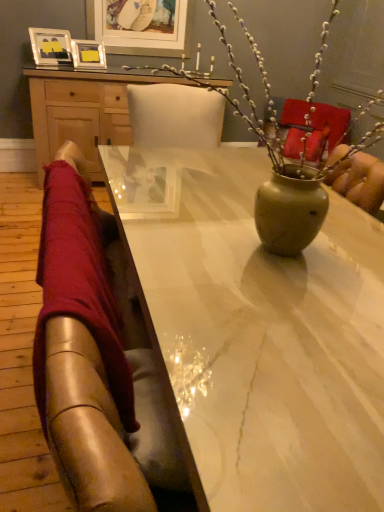
In order to face denim jeans at left, should I rotate leftwards or rightwards?

It's best to rotate left around 16.180 degrees.

Locate an element on the screen. This screenshot has height=512, width=384. wooden desk at upper center is located at coordinates (84, 111).

Measure the distance between point (91, 9) and camera.

Point (91, 9) and camera are 11.48 feet apart.

The width and height of the screenshot is (384, 512). I want to click on white marble table at center, so point(257,333).

Does matte silver picture frame at upper left, which is the first picture frame in left-to-right order, touch white marble table at center?

matte silver picture frame at upper left, which is the first picture frame in left-to-right order, and white marble table at center are not in contact.

Is matte silver picture frame at upper left, which is the first picture frame in left-to-right order, surrounding white marble table at center?

No.

Could you measure the distance between matte silver picture frame at upper left, which appears as the 3th picture frame when viewed from the right, and white marble table at center?

The distance of matte silver picture frame at upper left, which appears as the 3th picture frame when viewed from the right, from white marble table at center is 8.07 feet.

From a real-world perspective, is matte silver picture frame at upper left, which is the first picture frame in left-to-right order, located higher than white marble table at center?

Correct, in the physical world, matte silver picture frame at upper left, which is the first picture frame in left-to-right order, is higher than white marble table at center.

Is matte green vase at center turned away from matte silver picture frame at upper left, marked as the 2th picture frame in a left-to-right arrangement?

No, matte green vase at center is not facing the opposite direction of matte silver picture frame at upper left, marked as the 2th picture frame in a left-to-right arrangement.

Which object is further away from the camera taking this photo, matte green vase at center or matte silver picture frame at upper left, marked as the 2th picture frame in a left-to-right arrangement?

matte silver picture frame at upper left, marked as the 2th picture frame in a left-to-right arrangement, is behind.

Is matte green vase at center far away from matte silver picture frame at upper left, which appears as the second picture frame when viewed from the right?

Yes, matte green vase at center is far from matte silver picture frame at upper left, which appears as the second picture frame when viewed from the right.

Is matte green vase at center to the left of matte silver picture frame at upper left, marked as the 2th picture frame in a left-to-right arrangement, from the viewer's perspective?

In fact, matte green vase at center is to the right of matte silver picture frame at upper left, marked as the 2th picture frame in a left-to-right arrangement.

In the scene shown: Considering the positions of objects matte green vase at center and matte white picture frame at upper center, the 1th picture frame when ordered from right to left, in the image provided, who is more to the right, matte green vase at center or matte white picture frame at upper center, the 1th picture frame when ordered from right to left,?

Positioned to the right is matte green vase at center.

Can you confirm if matte green vase at center is bigger than matte white picture frame at upper center, marked as the 3th picture frame in a left-to-right arrangement?

Yes, matte green vase at center is bigger than matte white picture frame at upper center, marked as the 3th picture frame in a left-to-right arrangement.

Based on the photo, from the image's perspective, is matte green vase at center located beneath matte white picture frame at upper center, marked as the 3th picture frame in a left-to-right arrangement?

Correct, matte green vase at center appears lower than matte white picture frame at upper center, marked as the 3th picture frame in a left-to-right arrangement, in the image.

Is matte green vase at center shorter than matte white picture frame at upper center, marked as the 3th picture frame in a left-to-right arrangement?

No, matte green vase at center is not shorter than matte white picture frame at upper center, marked as the 3th picture frame in a left-to-right arrangement.

This screenshot has width=384, height=512. Find the location of `table to the right of matte white picture frame at upper center, marked as the 3th picture frame in a left-to-right arrangement`. table to the right of matte white picture frame at upper center, marked as the 3th picture frame in a left-to-right arrangement is located at coordinates (257, 333).

Could you tell me if matte white picture frame at upper center, the 1th picture frame when ordered from right to left, is facing white marble table at center?

Yes, matte white picture frame at upper center, the 1th picture frame when ordered from right to left, faces towards white marble table at center.

In the scene shown: From a real-world perspective, is matte white picture frame at upper center, the 1th picture frame when ordered from right to left, on top of white marble table at center?

Yes, from a real-world perspective, matte white picture frame at upper center, the 1th picture frame when ordered from right to left, is on top of white marble table at center.

Who is taller, matte silver picture frame at upper left, which appears as the second picture frame when viewed from the right, or white marble table at center?

Standing taller between the two is white marble table at center.

From the image's perspective, between matte silver picture frame at upper left, which appears as the second picture frame when viewed from the right, and white marble table at center, which one is located above?

matte silver picture frame at upper left, which appears as the second picture frame when viewed from the right, is shown above in the image.

Which is behind, matte silver picture frame at upper left, marked as the 2th picture frame in a left-to-right arrangement, or white marble table at center?

matte silver picture frame at upper left, marked as the 2th picture frame in a left-to-right arrangement, is further away from the camera.

Can we say matte silver picture frame at upper left, marked as the 2th picture frame in a left-to-right arrangement, lies outside white marble table at center?

Absolutely, matte silver picture frame at upper left, marked as the 2th picture frame in a left-to-right arrangement, is external to white marble table at center.

Based on the photo, does denim jeans at left have a greater width compared to wooden desk at upper center?

No, denim jeans at left is not wider than wooden desk at upper center.

From the image's perspective, would you say denim jeans at left is shown under wooden desk at upper center?

Correct, denim jeans at left appears lower than wooden desk at upper center in the image.

From a real-world perspective, is denim jeans at left positioned under wooden desk at upper center based on gravity?

Incorrect, from a real-world perspective, denim jeans at left is higher than wooden desk at upper center.

Which is more to the left, denim jeans at left or wooden desk at upper center?

wooden desk at upper center.

Can you confirm if matte silver picture frame at upper left, which is the first picture frame in left-to-right order, is positioned to the right of matte silver picture frame at upper left, marked as the 2th picture frame in a left-to-right arrangement?

Incorrect, matte silver picture frame at upper left, which is the first picture frame in left-to-right order, is not on the right side of matte silver picture frame at upper left, marked as the 2th picture frame in a left-to-right arrangement.

From a real-world perspective, who is located lower, matte silver picture frame at upper left, which is the first picture frame in left-to-right order, or matte silver picture frame at upper left, marked as the 2th picture frame in a left-to-right arrangement?

matte silver picture frame at upper left, marked as the 2th picture frame in a left-to-right arrangement, is physically lower.

In the scene shown: Which is in front, matte silver picture frame at upper left, which appears as the 3th picture frame when viewed from the right, or matte silver picture frame at upper left, which appears as the second picture frame when viewed from the right?

matte silver picture frame at upper left, which appears as the 3th picture frame when viewed from the right, is more forward.

You are a GUI agent. You are given a task and a screenshot of the screen. Output one action in this format:
    pyautogui.click(x=<x>, y=<y>)
    Task: Click on the table that is below the matte silver picture frame at upper left, which appears as the 3th picture frame when viewed from the right (from the image's perspective)
    The image size is (384, 512).
    Given the screenshot: What is the action you would take?
    pyautogui.click(x=257, y=333)

From a real-world perspective, count 2nd picture frames downward from the matte green vase at center and point to it. Please provide its 2D coordinates.

[(88, 55)]

Looking at the image, which one is located further to matte white picture frame at upper center, marked as the 3th picture frame in a left-to-right arrangement, denim jeans at left or matte silver picture frame at upper left, which is the first picture frame in left-to-right order?

denim jeans at left lies further to matte white picture frame at upper center, marked as the 3th picture frame in a left-to-right arrangement, than the other object.

From the image, which object appears to be nearer to denim jeans at left, matte silver picture frame at upper left, which appears as the 3th picture frame when viewed from the right, or matte green vase at center?

matte green vase at center is closer to denim jeans at left.

Which object lies nearer to the anchor point matte silver picture frame at upper left, which appears as the second picture frame when viewed from the right, matte white picture frame at upper center, the 1th picture frame when ordered from right to left, or denim jeans at left?

matte white picture frame at upper center, the 1th picture frame when ordered from right to left, lies closer to matte silver picture frame at upper left, which appears as the second picture frame when viewed from the right, than the other object.

Looking at the image, which one is located closer to denim jeans at left, matte silver picture frame at upper left, which appears as the 3th picture frame when viewed from the right, or matte silver picture frame at upper left, marked as the 2th picture frame in a left-to-right arrangement?

Among the two, matte silver picture frame at upper left, which appears as the 3th picture frame when viewed from the right, is located nearer to denim jeans at left.

Estimate the real-world distances between objects in this image. Which object is closer to matte silver picture frame at upper left, which appears as the second picture frame when viewed from the right, matte green vase at center or white marble table at center?

matte green vase at center is positioned closer to the anchor matte silver picture frame at upper left, which appears as the second picture frame when viewed from the right.

When comparing their distances from matte silver picture frame at upper left, which appears as the second picture frame when viewed from the right, does denim jeans at left or white marble table at center seem further?

denim jeans at left.

From the image, which object appears to be farther from matte white picture frame at upper center, the 1th picture frame when ordered from right to left, wooden desk at upper center or matte silver picture frame at upper left, marked as the 2th picture frame in a left-to-right arrangement?

Among the two, wooden desk at upper center is located further to matte white picture frame at upper center, the 1th picture frame when ordered from right to left.

From the image, which object appears to be nearer to matte silver picture frame at upper left, which is the first picture frame in left-to-right order, denim jeans at left or matte green vase at center?

Result: matte green vase at center is positioned closer to the anchor matte silver picture frame at upper left, which is the first picture frame in left-to-right order.

This screenshot has width=384, height=512. I want to click on selfie between matte green vase at center and matte silver picture frame at upper left, marked as the 2th picture frame in a left-to-right arrangement, along the z-axis, so click(88, 424).

Identify the location of picture frame between white marble table at center and matte silver picture frame at upper left, which appears as the second picture frame when viewed from the right, from front to back. (50, 46).

You are a GUI agent. You are given a task and a screenshot of the screen. Output one action in this format:
    pyautogui.click(x=<x>, y=<y>)
    Task: Click on the selfie between white marble table at center and wooden desk at upper center along the z-axis
    The width and height of the screenshot is (384, 512).
    Given the screenshot: What is the action you would take?
    [x=88, y=424]

Locate an element on the screen. Image resolution: width=384 pixels, height=512 pixels. desk between matte green vase at center and matte silver picture frame at upper left, which appears as the 3th picture frame when viewed from the right, along the z-axis is located at coordinates (84, 111).